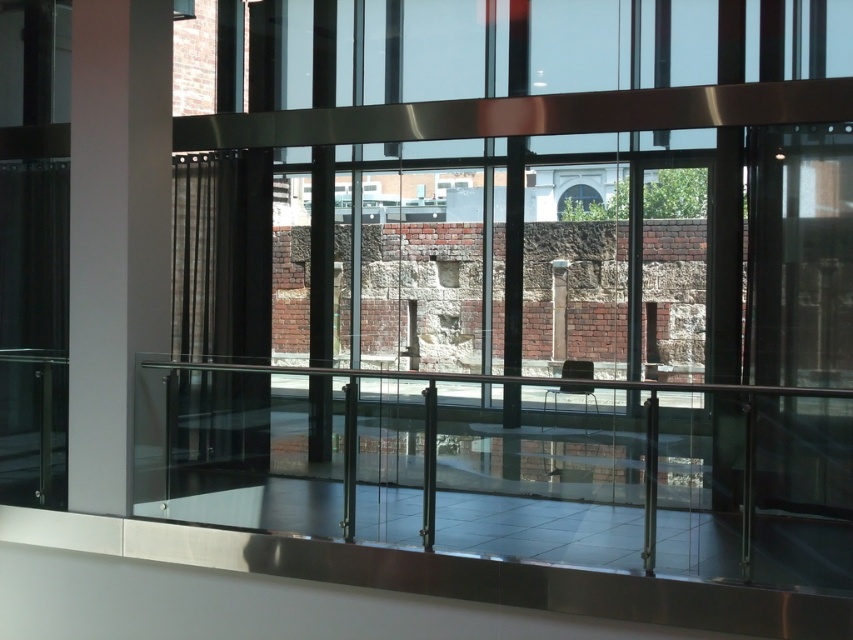
You are an interior designer planning to place a 1.5 meter wide sofa in the living room. The clear glass railing at center and the white glossy pillar at left are in the way. Which object do you need to consider the width of to ensure the sofa can pass through the space between them?

The clear glass railing at center has a larger width than the white glossy pillar at left. Therefore, you should consider the width of the clear glass railing at center to ensure the sofa can pass through the space between them.

From the picture: You are a delivery person standing at the entrance of the modern interior space. You need to place a package on the clear glass railing at center, which is 1.2 meters wide. Can you safely place the package on the railing without it falling off?

The clear glass railing at center is 4.71 meters from the camera, so the distance is too far to safely place the package on it without risking it falling off.